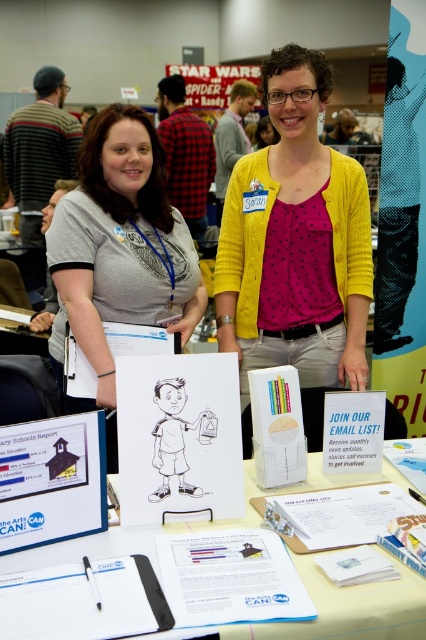
You are organizing materials on the table and need to access the white paper at center. Is the black matte folder at lower left blocking your access to it?

The black matte folder at lower left is behind the white paper at center, so it is not blocking access to the white paper at center.